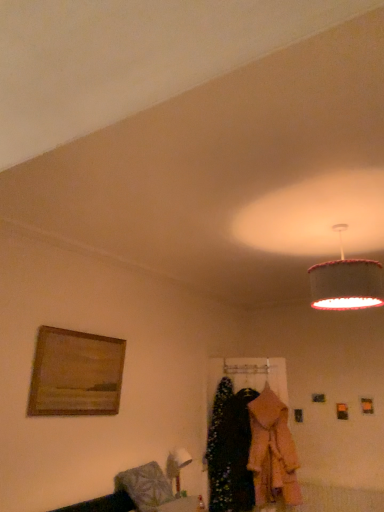
What do you see at coordinates (230, 450) in the screenshot? This screenshot has width=384, height=512. I see `velvet black dress at center, marked as the 2th clothing in a right-to-left arrangement` at bounding box center [230, 450].

Locate an element on the screen. light pink fabric coat at center, placed as the second clothing when sorted from left to right is located at coordinates (272, 452).

Locate an element on the screen. textured fabric lampshade at upper right is located at coordinates (346, 282).

Measure the distance between wooden framed painting at left and camera.

The distance of wooden framed painting at left from camera is 2.74 meters.

What is the approximate height of wooden framed painting at left?

It is 23.20 inches.

Where is `velvet black dress at center, marked as the 2th clothing in a right-to-left arrangement`? This screenshot has width=384, height=512. velvet black dress at center, marked as the 2th clothing in a right-to-left arrangement is located at coordinates (230, 450).

Between light pink fabric coat at center, placed as the second clothing when sorted from left to right, and velvet black dress at center, which is the 1th clothing from left to right, which one has less height?

light pink fabric coat at center, placed as the second clothing when sorted from left to right.

Relative to velvet black dress at center, which is the 1th clothing from left to right, is light pink fabric coat at center, which is the 1th clothing in right-to-left order, in front or behind?

Visually, light pink fabric coat at center, which is the 1th clothing in right-to-left order, is located in front of velvet black dress at center, which is the 1th clothing from left to right.

Is light pink fabric coat at center, which is the 1th clothing in right-to-left order, bigger than velvet black dress at center, which is the 1th clothing from left to right?

Correct, light pink fabric coat at center, which is the 1th clothing in right-to-left order, is larger in size than velvet black dress at center, which is the 1th clothing from left to right.

Is light pink fabric coat at center, which is the 1th clothing in right-to-left order, with velvet black dress at center, which is the 1th clothing from left to right?

No, light pink fabric coat at center, which is the 1th clothing in right-to-left order, is not touching velvet black dress at center, which is the 1th clothing from left to right.

Can you see textured fabric lampshade at upper right touching velvet black dress at center, marked as the 2th clothing in a right-to-left arrangement?

No, textured fabric lampshade at upper right is not in contact with velvet black dress at center, marked as the 2th clothing in a right-to-left arrangement.

Which is more to the left, textured fabric lampshade at upper right or velvet black dress at center, which is the 1th clothing from left to right?

From the viewer's perspective, velvet black dress at center, which is the 1th clothing from left to right, appears more on the left side.

Is point (380, 294) farther from camera compared to point (239, 504)?

No, it is not.

At what (x,y) coordinates should I click in order to perform the action: click on the 2nd clothing below the textured fabric lampshade at upper right (from the image's perspective). Please return your answer as a coordinate pair (x, y). Image resolution: width=384 pixels, height=512 pixels. Looking at the image, I should click on (230, 450).

How many degrees apart are the facing directions of velvet black dress at center, which is the 1th clothing from left to right, and light pink fabric coat at center, placed as the second clothing when sorted from left to right?

There is a 0.000426-degree angle between the facing directions of velvet black dress at center, which is the 1th clothing from left to right, and light pink fabric coat at center, placed as the second clothing when sorted from left to right.

Which object is more forward, velvet black dress at center, which is the 1th clothing from left to right, or light pink fabric coat at center, placed as the second clothing when sorted from left to right?

light pink fabric coat at center, placed as the second clothing when sorted from left to right, is in front.

Which is correct: velvet black dress at center, marked as the 2th clothing in a right-to-left arrangement, is inside light pink fabric coat at center, which is the 1th clothing in right-to-left order, or outside of it?

velvet black dress at center, marked as the 2th clothing in a right-to-left arrangement, is spatially situated outside light pink fabric coat at center, which is the 1th clothing in right-to-left order.

From the image's perspective, is velvet black dress at center, which is the 1th clothing from left to right, above or below light pink fabric coat at center, placed as the second clothing when sorted from left to right?

velvet black dress at center, which is the 1th clothing from left to right, is below light pink fabric coat at center, placed as the second clothing when sorted from left to right.

From a real-world perspective, is wooden framed painting at left beneath light pink fabric coat at center, placed as the second clothing when sorted from left to right?

No, from a real-world perspective, wooden framed painting at left is not below light pink fabric coat at center, placed as the second clothing when sorted from left to right.

Is the surface of wooden framed painting at left in direct contact with light pink fabric coat at center, placed as the second clothing when sorted from left to right?

No, wooden framed painting at left is not in contact with light pink fabric coat at center, placed as the second clothing when sorted from left to right.

How different are the orientations of wooden framed painting at left and light pink fabric coat at center, placed as the second clothing when sorted from left to right, in degrees?

They differ by 72.7 degrees in their facing directions.

Does light pink fabric coat at center, which is the 1th clothing in right-to-left order, have a lesser height compared to wooden framed painting at left?

No, light pink fabric coat at center, which is the 1th clothing in right-to-left order, is not shorter than wooden framed painting at left.

From the image's perspective, is light pink fabric coat at center, which is the 1th clothing in right-to-left order, above or below wooden framed painting at left?

light pink fabric coat at center, which is the 1th clothing in right-to-left order, is situated lower than wooden framed painting at left in the image.

From a real-world perspective, who is located lower, light pink fabric coat at center, placed as the second clothing when sorted from left to right, or wooden framed painting at left?

light pink fabric coat at center, placed as the second clothing when sorted from left to right, is physically lower.

Is light pink fabric coat at center, placed as the second clothing when sorted from left to right, not close to wooden framed painting at left?

Absolutely, light pink fabric coat at center, placed as the second clothing when sorted from left to right, is distant from wooden framed painting at left.

Between wooden framed painting at left and textured fabric lampshade at upper right, which one has larger width?

textured fabric lampshade at upper right.

From the picture: Considering the sizes of objects wooden framed painting at left and textured fabric lampshade at upper right in the image provided, who is taller, wooden framed painting at left or textured fabric lampshade at upper right?

wooden framed painting at left.

Does point (53, 386) come closer to viewer compared to point (357, 269)?

That is False.

From the image's perspective, which object appears higher, velvet black dress at center, marked as the 2th clothing in a right-to-left arrangement, or textured fabric lampshade at upper right?

textured fabric lampshade at upper right, from the image's perspective.

Between velvet black dress at center, marked as the 2th clothing in a right-to-left arrangement, and textured fabric lampshade at upper right, which one appears on the right side from the viewer's perspective?

Positioned to the right is textured fabric lampshade at upper right.

Is velvet black dress at center, marked as the 2th clothing in a right-to-left arrangement, smaller than textured fabric lampshade at upper right?

No, velvet black dress at center, marked as the 2th clothing in a right-to-left arrangement, is not smaller than textured fabric lampshade at upper right.

Identify the location of clothing on the right of velvet black dress at center, which is the 1th clothing from left to right. (272, 452).

There is a textured fabric lampshade at upper right. Find the location of `the 2nd clothing below it (from the image's perspective)`. the 2nd clothing below it (from the image's perspective) is located at coordinates (230, 450).

Based on the photo, which object lies further to the anchor point light pink fabric coat at center, placed as the second clothing when sorted from left to right, wooden framed painting at left or velvet black dress at center, marked as the 2th clothing in a right-to-left arrangement?

The object further to light pink fabric coat at center, placed as the second clothing when sorted from left to right, is wooden framed painting at left.

When comparing their distances from light pink fabric coat at center, placed as the second clothing when sorted from left to right, does velvet black dress at center, marked as the 2th clothing in a right-to-left arrangement, or textured fabric lampshade at upper right seem closer?

velvet black dress at center, marked as the 2th clothing in a right-to-left arrangement, is closer to light pink fabric coat at center, placed as the second clothing when sorted from left to right.

In the scene shown: Estimate the real-world distances between objects in this image. Which object is further from light pink fabric coat at center, placed as the second clothing when sorted from left to right, textured fabric lampshade at upper right or velvet black dress at center, marked as the 2th clothing in a right-to-left arrangement?

textured fabric lampshade at upper right.

When comparing their distances from light pink fabric coat at center, placed as the second clothing when sorted from left to right, does velvet black dress at center, which is the 1th clothing from left to right, or wooden framed painting at left seem closer?

velvet black dress at center, which is the 1th clothing from left to right, lies closer to light pink fabric coat at center, placed as the second clothing when sorted from left to right, than the other object.

Which object lies further to the anchor point textured fabric lampshade at upper right, light pink fabric coat at center, which is the 1th clothing in right-to-left order, or wooden framed painting at left?

light pink fabric coat at center, which is the 1th clothing in right-to-left order, lies further to textured fabric lampshade at upper right than the other object.

Estimate the real-world distances between objects in this image. Which object is further from wooden framed painting at left, velvet black dress at center, which is the 1th clothing from left to right, or textured fabric lampshade at upper right?

Among the two, textured fabric lampshade at upper right is located further to wooden framed painting at left.

Looking at this image, when comparing their distances from textured fabric lampshade at upper right, does wooden framed painting at left or light pink fabric coat at center, placed as the second clothing when sorted from left to right, seem further?

light pink fabric coat at center, placed as the second clothing when sorted from left to right, is further to textured fabric lampshade at upper right.

When comparing their distances from velvet black dress at center, marked as the 2th clothing in a right-to-left arrangement, does wooden framed painting at left or light pink fabric coat at center, which is the 1th clothing in right-to-left order, seem further?

Among the two, wooden framed painting at left is located further to velvet black dress at center, marked as the 2th clothing in a right-to-left arrangement.

Where is `clothing between textured fabric lampshade at upper right and velvet black dress at center, which is the 1th clothing from left to right, in the vertical direction`? Image resolution: width=384 pixels, height=512 pixels. clothing between textured fabric lampshade at upper right and velvet black dress at center, which is the 1th clothing from left to right, in the vertical direction is located at coordinates (272, 452).

Where is `clothing between wooden framed painting at left and light pink fabric coat at center, placed as the second clothing when sorted from left to right, from left to right`? The image size is (384, 512). clothing between wooden framed painting at left and light pink fabric coat at center, placed as the second clothing when sorted from left to right, from left to right is located at coordinates (230, 450).

At what (x,y) coordinates should I click in order to perform the action: click on picture frame between textured fabric lampshade at upper right and velvet black dress at center, which is the 1th clothing from left to right, in the vertical direction. Please return your answer as a coordinate pair (x, y). Looking at the image, I should click on (75, 374).